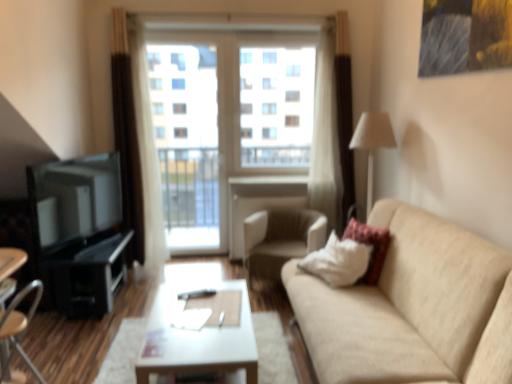
Question: Is beige fabric couch at right oriented towards velvet-like beige pillow at right?

Choices:
 (A) yes
 (B) no

Answer: (A)

Question: From the image's perspective, is beige fabric couch at right on velvet-like beige pillow at right?

Choices:
 (A) no
 (B) yes

Answer: (A)

Question: Is beige fabric couch at right next to velvet-like beige pillow at right?

Choices:
 (A) no
 (B) yes

Answer: (A)

Question: Is beige fabric couch at right at the right side of velvet-like beige pillow at right?

Choices:
 (A) yes
 (B) no

Answer: (B)

Question: Considering the relative positions of beige fabric couch at right and velvet-like beige pillow at right in the image provided, is beige fabric couch at right in front of velvet-like beige pillow at right?

Choices:
 (A) yes
 (B) no

Answer: (A)

Question: Is transparent glass window at center in front of or behind transparent glass screen door at center in the image?

Choices:
 (A) behind
 (B) front

Answer: (A)

Question: Considering the positions of point (283, 109) and point (165, 193), is point (283, 109) closer or farther from the camera than point (165, 193)?

Choices:
 (A) farther
 (B) closer

Answer: (B)

Question: From a real-world perspective, relative to transparent glass screen door at center, is transparent glass window at center vertically above or below?

Choices:
 (A) below
 (B) above

Answer: (B)

Question: Is transparent glass window at center situated inside transparent glass screen door at center or outside?

Choices:
 (A) inside
 (B) outside

Answer: (B)

Question: Considering the relative positions of white fabric lampshade at right and wooden chair at lower left, which appears as the 1th chair when viewed from the front, in the image provided, is white fabric lampshade at right to the left or to the right of wooden chair at lower left, which appears as the 1th chair when viewed from the front,?

Choices:
 (A) left
 (B) right

Answer: (B)

Question: Is white fabric lampshade at right in front of or behind wooden chair at lower left, which ranks as the second chair in back-to-front order, in the image?

Choices:
 (A) front
 (B) behind

Answer: (B)

Question: Is white fabric lampshade at right wider or thinner than wooden chair at lower left, which ranks as the second chair in back-to-front order?

Choices:
 (A) thin
 (B) wide

Answer: (B)

Question: Considering the positions of point (381, 145) and point (41, 289), is point (381, 145) closer or farther from the camera than point (41, 289)?

Choices:
 (A) farther
 (B) closer

Answer: (A)

Question: In the image, is wooden chair at lower left, which appears as the 1th chair when viewed from the front, on the left side or the right side of beige fabric couch at right?

Choices:
 (A) right
 (B) left

Answer: (B)

Question: Considering the positions of wooden chair at lower left, which appears as the 1th chair when viewed from the front, and beige fabric couch at right in the image, is wooden chair at lower left, which appears as the 1th chair when viewed from the front, bigger or smaller than beige fabric couch at right?

Choices:
 (A) small
 (B) big

Answer: (A)